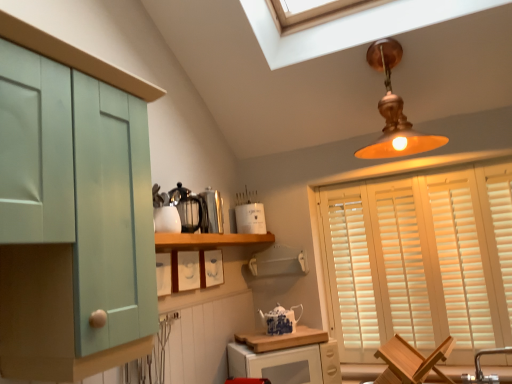
What do you see at coordinates (73, 244) in the screenshot? I see `mint green wood cabinet at left, marked as the 1th cabinetry in a left-to-right arrangement` at bounding box center [73, 244].

Find the location of a particular element. The image size is (512, 384). wooden chair at lower right is located at coordinates (410, 362).

The height and width of the screenshot is (384, 512). Find the location of `copper/brass pendant light at upper center`. copper/brass pendant light at upper center is located at coordinates (394, 111).

Identify the location of white glossy microwave at lower center, the 1th cabinetry viewed from the back. (286, 357).

Where is `mint green wood cabinet at left, the 1th cabinetry viewed from the front`? Image resolution: width=512 pixels, height=384 pixels. mint green wood cabinet at left, the 1th cabinetry viewed from the front is located at coordinates pyautogui.click(x=73, y=244).

Is brushed metal faucet at lower right outside of wooden chair at lower right?

A: Yes, brushed metal faucet at lower right is located beyond the bounds of wooden chair at lower right.

From the image's perspective, is brushed metal faucet at lower right below wooden chair at lower right?

No.

Which object is further away from the camera, brushed metal faucet at lower right or wooden chair at lower right?

brushed metal faucet at lower right is more distant.

Between brushed metal faucet at lower right and wooden chair at lower right, which one has larger width?

With larger width is wooden chair at lower right.

Does white glossy microwave at lower center, the 1th cabinetry viewed from the back, have a greater height compared to wooden cutting board at lower center?

Correct, white glossy microwave at lower center, the 1th cabinetry viewed from the back, is much taller as wooden cutting board at lower center.

Is white glossy microwave at lower center, positioned as the 2th cabinetry in left-to-right order, oriented towards wooden cutting board at lower center?

No, white glossy microwave at lower center, positioned as the 2th cabinetry in left-to-right order, is not oriented towards wooden cutting board at lower center.

Looking at this image, would you consider white glossy microwave at lower center, the second cabinetry positioned from the top, to be distant from wooden cutting board at lower center?

Actually, white glossy microwave at lower center, the second cabinetry positioned from the top, and wooden cutting board at lower center are a little close together.

Which of these two, white glossy microwave at lower center, the second cabinetry positioned from the top, or wooden cutting board at lower center, is wider?

wooden cutting board at lower center is wider.

Considering the relative sizes of wooden cutting board at lower center and copper/brass pendant light at upper center in the image provided, is wooden cutting board at lower center wider than copper/brass pendant light at upper center?

Incorrect, the width of wooden cutting board at lower center does not surpass that of copper/brass pendant light at upper center.

Looking at this image, from the image's perspective, which one is positioned lower, wooden cutting board at lower center or copper/brass pendant light at upper center?

wooden cutting board at lower center.

Which is nearer, (248, 337) or (392, 55)?

The point (392, 55) is closer to the camera.

Is the surface of wooden cutting board at lower center in direct contact with copper/brass pendant light at upper center?

No, wooden cutting board at lower center is not next to copper/brass pendant light at upper center.

Is white matte container at upper center, the third appliance when ordered from front to back, looking in the opposite direction of wooden chair at lower right?

No, white matte container at upper center, the third appliance when ordered from front to back,'s orientation is not away from wooden chair at lower right.

Which is in front, white matte container at upper center, the third appliance when ordered from front to back, or wooden chair at lower right?

wooden chair at lower right is closer to the camera.

Visually, is white matte container at upper center, the third appliance when ordered from front to back, positioned to the left or to the right of wooden chair at lower right?

Clearly, white matte container at upper center, the third appliance when ordered from front to back, is on the left of wooden chair at lower right in the image.

From the image's perspective, is white matte container at upper center, the third appliance when ordered from front to back, above wooden chair at lower right?

Correct, white matte container at upper center, the third appliance when ordered from front to back, appears higher than wooden chair at lower right in the image.

Is point (403, 133) closer to camera compared to point (201, 236)?

No, (403, 133) is further to viewer.

Who is smaller, copper/brass pendant light at upper center or wooden shelf at center?

Smaller between the two is wooden shelf at center.

From the image's perspective, between copper/brass pendant light at upper center and wooden shelf at center, which one is located above?

From the image's view, copper/brass pendant light at upper center is above.

I want to click on shelf on the left of copper/brass pendant light at upper center, so click(208, 241).

Starting from the blue and white porcelain teapot at center, which appliance is the 1st one in front? Please provide its 2D coordinates.

[(212, 211)]

How far apart are metallic silver kettle at center, placed as the 2th appliance when sorted from back to front, and blue and white porcelain teapot at center?

The distance of metallic silver kettle at center, placed as the 2th appliance when sorted from back to front, from blue and white porcelain teapot at center is 22.31 inches.

Considering the sizes of metallic silver kettle at center, which is counted as the 2th appliance, starting from the front, and blue and white porcelain teapot at center in the image, is metallic silver kettle at center, which is counted as the 2th appliance, starting from the front, wider or thinner than blue and white porcelain teapot at center?

Clearly, metallic silver kettle at center, which is counted as the 2th appliance, starting from the front, has more width compared to blue and white porcelain teapot at center.

Relative to blue and white porcelain teapot at center, is metallic silver kettle at center, placed as the 2th appliance when sorted from back to front, in front or behind?

Clearly, metallic silver kettle at center, placed as the 2th appliance when sorted from back to front, is in front of blue and white porcelain teapot at center.

From the image's perspective, is wooden chair at lower right located above mint green wood cabinet at left, the first cabinetry in the top-to-bottom sequence?

No, from the image's perspective, wooden chair at lower right is not on top of mint green wood cabinet at left, the first cabinetry in the top-to-bottom sequence.

Is mint green wood cabinet at left, the 1th cabinetry viewed from the front, completely or partially inside wooden chair at lower right?

No, mint green wood cabinet at left, the 1th cabinetry viewed from the front, is not inside wooden chair at lower right.

Is point (438, 352) positioned before point (87, 197)?

No, (438, 352) is behind (87, 197).

Is wooden chair at lower right oriented away from mint green wood cabinet at left, which is the second cabinetry in back-to-front order?

That's not correct — wooden chair at lower right is not looking away from mint green wood cabinet at left, which is the second cabinetry in back-to-front order.

The image size is (512, 384). In order to click on chair that appears in front of the brushed metal faucet at lower right in this screenshot , I will do `click(410, 362)`.

Find the location of `cabinetry that is on the right side of wooden cutting board at lower center`. cabinetry that is on the right side of wooden cutting board at lower center is located at coordinates (286, 357).

Considering their positions, is white matte container at upper center, the third appliance when ordered from front to back, positioned closer to copper/brass pendant light at upper center than mint green wood cabinet at left, positioned as the 2th cabinetry in bottom-to-top order?

Among the two, white matte container at upper center, the third appliance when ordered from front to back, is located nearer to copper/brass pendant light at upper center.

Which object lies further to the anchor point brushed metal faucet at lower right, mint green wood cabinet at left, marked as the 1th cabinetry in a left-to-right arrangement, or white wooden blinds at right?

mint green wood cabinet at left, marked as the 1th cabinetry in a left-to-right arrangement, is positioned further to the anchor brushed metal faucet at lower right.

From the image, which object appears to be farther from wooden shelf at center, wooden chair at lower right or white glossy microwave at lower center, the 1th cabinetry viewed from the back?

wooden chair at lower right lies further to wooden shelf at center than the other object.

When comparing their distances from white matte container at upper center, the third appliance when ordered from front to back, does wooden chair at lower right or polished stainless steel kettle at upper center, acting as the third appliance starting from the back, seem closer?

polished stainless steel kettle at upper center, acting as the third appliance starting from the back, lies closer to white matte container at upper center, the third appliance when ordered from front to back, than the other object.

When comparing their distances from wooden cutting board at lower center, does white wooden blinds at right or white matte container at upper center, arranged as the first appliance when viewed from the back, seem closer?

white matte container at upper center, arranged as the first appliance when viewed from the back, lies closer to wooden cutting board at lower center than the other object.

Looking at this image, considering their positions, is white wooden blinds at right positioned further to blue and white porcelain teapot at center than mint green wood cabinet at left, the 1th cabinetry viewed from the front?

Among the two, mint green wood cabinet at left, the 1th cabinetry viewed from the front, is located further to blue and white porcelain teapot at center.

Considering their positions, is white glossy microwave at lower center, the 1th cabinetry in the bottom-to-top sequence, positioned closer to mint green wood cabinet at left, marked as the 1th cabinetry in a left-to-right arrangement, than copper/brass pendant light at upper center?

Based on the image, white glossy microwave at lower center, the 1th cabinetry in the bottom-to-top sequence, appears to be nearer to mint green wood cabinet at left, marked as the 1th cabinetry in a left-to-right arrangement.

Looking at the image, which one is located further to mint green wood cabinet at left, positioned as the 2th cabinetry in bottom-to-top order, brushed metal faucet at lower right or white matte container at upper center, arranged as the first appliance when viewed from the back?

The object further to mint green wood cabinet at left, positioned as the 2th cabinetry in bottom-to-top order, is brushed metal faucet at lower right.

The width and height of the screenshot is (512, 384). What are the coordinates of `shelf between polished stainless steel kettle at upper center, acting as the third appliance starting from the back, and wooden chair at lower right, in the horizontal direction` in the screenshot? It's located at (208, 241).

At what (x,y) coordinates should I click in order to perform the action: click on countertop between metallic silver kettle at center, placed as the 2th appliance when sorted from back to front, and white wooden blinds at right from left to right. Please return your answer as a coordinate pair (x, y). The image size is (512, 384). Looking at the image, I should click on (281, 339).

The height and width of the screenshot is (384, 512). In order to click on shelf between copper/brass pendant light at upper center and wooden cutting board at lower center in the vertical direction in this screenshot , I will do click(208, 241).

Where is `cabinetry between mint green wood cabinet at left, the first cabinetry in the top-to-bottom sequence, and white wooden blinds at right, in the horizontal direction`? This screenshot has width=512, height=384. cabinetry between mint green wood cabinet at left, the first cabinetry in the top-to-bottom sequence, and white wooden blinds at right, in the horizontal direction is located at coordinates (286, 357).